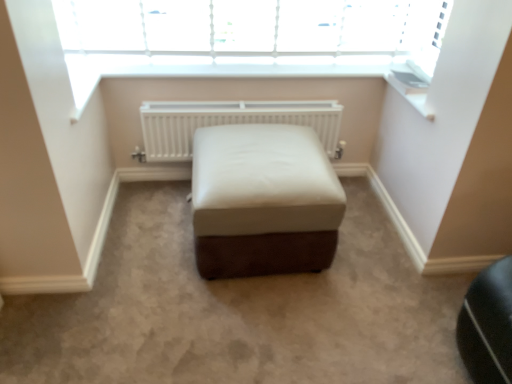
Question: From the image's perspective, is white matte radiator at center on white leather ottoman at center?

Choices:
 (A) yes
 (B) no

Answer: (A)

Question: Can you confirm if white matte radiator at center is positioned to the left of white leather ottoman at center?

Choices:
 (A) no
 (B) yes

Answer: (B)

Question: Could you tell me if white matte radiator at center is facing white leather ottoman at center?

Choices:
 (A) no
 (B) yes

Answer: (B)

Question: Is white matte radiator at center next to white leather ottoman at center and touching it?

Choices:
 (A) yes
 (B) no

Answer: (B)

Question: From a real-world perspective, is white matte radiator at center below white leather ottoman at center?

Choices:
 (A) yes
 (B) no

Answer: (B)

Question: Is white plastic window sill at upper right inside or outside of white matte radiator at center?

Choices:
 (A) inside
 (B) outside

Answer: (B)

Question: Considering the relative positions of white plastic window sill at upper right and white matte radiator at center in the image provided, is white plastic window sill at upper right to the left or to the right of white matte radiator at center?

Choices:
 (A) left
 (B) right

Answer: (B)

Question: From a real-world perspective, is white plastic window sill at upper right physically located above or below white matte radiator at center?

Choices:
 (A) above
 (B) below

Answer: (A)

Question: Considering the positions of white plastic window sill at upper right and white matte radiator at center in the image, is white plastic window sill at upper right bigger or smaller than white matte radiator at center?

Choices:
 (A) small
 (B) big

Answer: (A)

Question: Is point (292, 148) closer or farther from the camera than point (416, 100)?

Choices:
 (A) closer
 (B) farther

Answer: (A)

Question: From the image's perspective, is white leather ottoman at center located above or below white plastic window sill at upper right?

Choices:
 (A) above
 (B) below

Answer: (B)

Question: In terms of size, does white leather ottoman at center appear bigger or smaller than white plastic window sill at upper right?

Choices:
 (A) small
 (B) big

Answer: (B)

Question: In the image, is white leather ottoman at center on the left side or the right side of white plastic window sill at upper right?

Choices:
 (A) left
 (B) right

Answer: (A)

Question: Considering the positions of point (x=424, y=110) and point (x=207, y=175), is point (x=424, y=110) closer or farther from the camera than point (x=207, y=175)?

Choices:
 (A) closer
 (B) farther

Answer: (B)

Question: Looking at the image, does white plastic window sill at upper right seem bigger or smaller compared to white leather ottoman at center?

Choices:
 (A) small
 (B) big

Answer: (A)